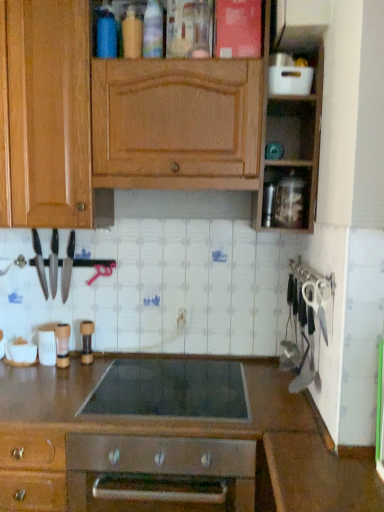
Identify the location of vacant space positioned to the left of clear plastic container at lower left, the 3th appliance when ordered from left to right. The height and width of the screenshot is (512, 384). pos(24,371).